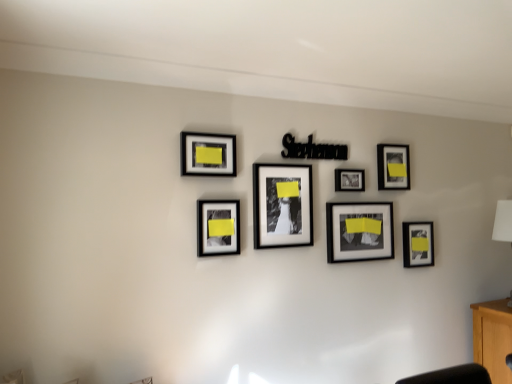
In order to face beech wood cabinet at lower right, should I rotate leftwards or rightwards?

You should look right and rotate roughly 31.203 degrees.

Measure the distance between matte black photo frame at center, the 3th picture frame from the left, and camera.

The distance of matte black photo frame at center, the 3th picture frame from the left, from camera is 6.80 feet.

The width and height of the screenshot is (512, 384). I want to click on black matte picture frame at center, which is the 3th picture frame in right-to-left order, so click(x=359, y=231).

What do you see at coordinates (349, 180) in the screenshot? I see `black matte picture frame at center, the 4th picture frame when ordered from right to left` at bounding box center [349, 180].

This screenshot has width=512, height=384. I want to click on matte black picture frame at center-left, arranged as the 6th picture frame when viewed from the right, so click(218, 227).

What do you see at coordinates (208, 154) in the screenshot? The width and height of the screenshot is (512, 384). I see `matte black frame at upper left, positioned as the seventh picture frame in right-to-left order` at bounding box center [208, 154].

In order to click on matte black frame at lower right, which appears as the seventh picture frame when viewed from the left in this screenshot , I will do `click(418, 244)`.

This screenshot has width=512, height=384. What do you see at coordinates (418, 244) in the screenshot? I see `matte black frame at lower right, which appears as the seventh picture frame when viewed from the left` at bounding box center [418, 244].

Locate an element on the screen. matte black picture frame at upper right, positioned as the sixth picture frame in left-to-right order is located at coordinates (393, 167).

Which point is more forward, (415, 232) or (332, 207)?

Point (332, 207)

Between matte black frame at lower right, which is the 1th picture frame from right to left, and black matte picture frame at center, which is the 3th picture frame in right-to-left order, which one has larger width?

Wider between the two is matte black frame at lower right, which is the 1th picture frame from right to left.

Can black matte picture frame at center, which is the 3th picture frame in right-to-left order, be found inside matte black frame at lower right, which appears as the seventh picture frame when viewed from the left?

No, black matte picture frame at center, which is the 3th picture frame in right-to-left order, is not a part of matte black frame at lower right, which appears as the seventh picture frame when viewed from the left.

From a real-world perspective, who is located higher, matte black frame at lower right, which appears as the seventh picture frame when viewed from the left, or black matte picture frame at center, placed as the fifth picture frame when sorted from left to right?

black matte picture frame at center, placed as the fifth picture frame when sorted from left to right.

Is beech wood cabinet at lower right surrounding white fabric lampshade at right?

Actually, white fabric lampshade at right is outside beech wood cabinet at lower right.

Considering the relative positions of beech wood cabinet at lower right and white fabric lampshade at right in the image provided, is beech wood cabinet at lower right behind white fabric lampshade at right?

No, it is in front of white fabric lampshade at right.

Visually, is beech wood cabinet at lower right positioned to the left or to the right of white fabric lampshade at right?

From the image, it's evident that beech wood cabinet at lower right is to the right of white fabric lampshade at right.

Is there a large distance between beech wood cabinet at lower right and white fabric lampshade at right?

No, beech wood cabinet at lower right is not far away from white fabric lampshade at right.

In the scene shown: Is the depth of matte black picture frame at center-left, arranged as the 6th picture frame when viewed from the right, greater than that of white fabric lampshade at right?

No, matte black picture frame at center-left, arranged as the 6th picture frame when viewed from the right, is closer to the viewer.

From a real-world perspective, between matte black picture frame at center-left, arranged as the 6th picture frame when viewed from the right, and white fabric lampshade at right, who is vertically lower?

white fabric lampshade at right is physically lower.

This screenshot has height=384, width=512. What are the coordinates of `table lamp that is under the matte black picture frame at center-left, arranged as the 6th picture frame when viewed from the right (from a real-world perspective)` in the screenshot? It's located at (503, 221).

Consider the image. Does matte black picture frame at upper right, positioned as the sixth picture frame in left-to-right order, have a greater height compared to matte black photo frame at center, the 3th picture frame from the left?

No.

Are matte black picture frame at upper right, positioned as the sixth picture frame in left-to-right order, and matte black photo frame at center, the fifth picture frame when ordered from right to left, located far from each other?

That's not correct — matte black picture frame at upper right, positioned as the sixth picture frame in left-to-right order, is a little close to matte black photo frame at center, the fifth picture frame when ordered from right to left.

Can you confirm if matte black picture frame at upper right, which is the 2th picture frame in right-to-left order, is positioned to the left of matte black photo frame at center, the 3th picture frame from the left?

No.

From the image's perspective, between matte black picture frame at upper right, which is the 2th picture frame in right-to-left order, and matte black photo frame at center, the fifth picture frame when ordered from right to left, who is located below?

matte black photo frame at center, the fifth picture frame when ordered from right to left, from the image's perspective.

Can we say matte black picture frame at upper right, which is the 2th picture frame in right-to-left order, lies outside matte black picture frame at center-left, the second picture frame positioned from the left?

Yes, matte black picture frame at upper right, which is the 2th picture frame in right-to-left order, is located beyond the bounds of matte black picture frame at center-left, the second picture frame positioned from the left.

Is matte black picture frame at upper right, positioned as the sixth picture frame in left-to-right order, further to the viewer compared to matte black picture frame at center-left, arranged as the 6th picture frame when viewed from the right?

Yes, the depth of matte black picture frame at upper right, positioned as the sixth picture frame in left-to-right order, is greater than that of matte black picture frame at center-left, arranged as the 6th picture frame when viewed from the right.

How many degrees apart are the facing directions of matte black picture frame at upper right, positioned as the sixth picture frame in left-to-right order, and matte black picture frame at center-left, the second picture frame positioned from the left?

The facing directions of matte black picture frame at upper right, positioned as the sixth picture frame in left-to-right order, and matte black picture frame at center-left, the second picture frame positioned from the left, are 0.00107 degrees apart.

Is matte black picture frame at upper right, which is the 2th picture frame in right-to-left order, turned away from matte black picture frame at center-left, arranged as the 6th picture frame when viewed from the right?

No, matte black picture frame at center-left, arranged as the 6th picture frame when viewed from the right, is not at the back of matte black picture frame at upper right, which is the 2th picture frame in right-to-left order.

Does matte black frame at lower right, which appears as the seventh picture frame when viewed from the left, have a greater width compared to matte black picture frame at center-left, arranged as the 6th picture frame when viewed from the right?

Yes, matte black frame at lower right, which appears as the seventh picture frame when viewed from the left, is wider than matte black picture frame at center-left, arranged as the 6th picture frame when viewed from the right.

Is matte black frame at lower right, which appears as the seventh picture frame when viewed from the left, oriented away from matte black picture frame at center-left, the second picture frame positioned from the left?

No, matte black picture frame at center-left, the second picture frame positioned from the left, is not at the back of matte black frame at lower right, which appears as the seventh picture frame when viewed from the left.

Measure the distance between matte black frame at lower right, which is the 1th picture frame from right to left, and matte black picture frame at center-left, the second picture frame positioned from the left.

The distance of matte black frame at lower right, which is the 1th picture frame from right to left, from matte black picture frame at center-left, the second picture frame positioned from the left, is 1.15 meters.

Looking at this image, is matte black frame at lower right, which appears as the seventh picture frame when viewed from the left, further to camera compared to matte black picture frame at center-left, arranged as the 6th picture frame when viewed from the right?

Yes, the depth of matte black frame at lower right, which appears as the seventh picture frame when viewed from the left, is greater than that of matte black picture frame at center-left, arranged as the 6th picture frame when viewed from the right.

Is white fabric lampshade at right turned away from beech wood cabinet at lower right?

white fabric lampshade at right does not have its back to beech wood cabinet at lower right.

Choose the correct answer: Is white fabric lampshade at right inside beech wood cabinet at lower right or outside it?

white fabric lampshade at right is not inside beech wood cabinet at lower right, it's outside.

Does white fabric lampshade at right appear on the right side of beech wood cabinet at lower right?

No, white fabric lampshade at right is not to the right of beech wood cabinet at lower right.

In the scene shown: Can you confirm if white fabric lampshade at right is thinner than beech wood cabinet at lower right?

Correct, the width of white fabric lampshade at right is less than that of beech wood cabinet at lower right.

There is a matte black frame at lower right, which appears as the seventh picture frame when viewed from the left. Where is `the 1st picture frame above it (from a real-world perspective)`? The height and width of the screenshot is (384, 512). the 1st picture frame above it (from a real-world perspective) is located at coordinates (359, 231).

The height and width of the screenshot is (384, 512). What are the coordinates of `computer desk directly beneath the white fabric lampshade at right (from a real-world perspective)` in the screenshot? It's located at tap(493, 338).

Estimate the real-world distances between objects in this image. Which object is closer to matte black frame at lower right, which is the 1th picture frame from right to left, matte black picture frame at upper right, which is the 2th picture frame in right-to-left order, or black matte picture frame at center, placed as the fifth picture frame when sorted from left to right?

The object closer to matte black frame at lower right, which is the 1th picture frame from right to left, is black matte picture frame at center, placed as the fifth picture frame when sorted from left to right.

Looking at the image, which one is located further to matte black picture frame at center-left, arranged as the 6th picture frame when viewed from the right, matte black frame at upper left, positioned as the seventh picture frame in right-to-left order, or matte black photo frame at center, the 3th picture frame from the left?

matte black frame at upper left, positioned as the seventh picture frame in right-to-left order, is further to matte black picture frame at center-left, arranged as the 6th picture frame when viewed from the right.

Considering their positions, is matte black frame at lower right, which appears as the seventh picture frame when viewed from the left, positioned further to matte black frame at upper left, positioned as the seventh picture frame in right-to-left order, than black matte picture frame at center, the 4th picture frame when ordered from right to left?

Among the two, matte black frame at lower right, which appears as the seventh picture frame when viewed from the left, is located further to matte black frame at upper left, positioned as the seventh picture frame in right-to-left order.

When comparing their distances from beech wood cabinet at lower right, does matte black picture frame at center-left, arranged as the 6th picture frame when viewed from the right, or white fabric lampshade at right seem closer?

Among the two, white fabric lampshade at right is located nearer to beech wood cabinet at lower right.

Considering their positions, is black matte picture frame at center, which is the 3th picture frame in right-to-left order, positioned closer to matte black photo frame at center, the 3th picture frame from the left, than matte black picture frame at center-left, the second picture frame positioned from the left?

Based on the image, matte black picture frame at center-left, the second picture frame positioned from the left, appears to be nearer to matte black photo frame at center, the 3th picture frame from the left.

When comparing their distances from beech wood cabinet at lower right, does matte black frame at upper left, positioned as the seventh picture frame in right-to-left order, or black matte picture frame at center, the 4th picture frame when ordered from right to left, seem closer?

Based on the image, black matte picture frame at center, the 4th picture frame when ordered from right to left, appears to be nearer to beech wood cabinet at lower right.

Looking at this image, estimate the real-world distances between objects in this image. Which object is further from beech wood cabinet at lower right, matte black frame at upper left, positioned as the seventh picture frame in right-to-left order, or matte black frame at lower right, which appears as the seventh picture frame when viewed from the left?

The object further to beech wood cabinet at lower right is matte black frame at upper left, positioned as the seventh picture frame in right-to-left order.

Which object lies further to the anchor point black matte picture frame at center, which is the 3th picture frame in right-to-left order, matte black picture frame at center-left, arranged as the 6th picture frame when viewed from the right, or white fabric lampshade at right?

Based on the image, white fabric lampshade at right appears to be further to black matte picture frame at center, which is the 3th picture frame in right-to-left order.

Where is `table lamp between matte black picture frame at upper right, positioned as the sixth picture frame in left-to-right order, and beech wood cabinet at lower right in the up-down direction`? This screenshot has width=512, height=384. table lamp between matte black picture frame at upper right, positioned as the sixth picture frame in left-to-right order, and beech wood cabinet at lower right in the up-down direction is located at coordinates click(x=503, y=221).

The width and height of the screenshot is (512, 384). What are the coordinates of `table lamp situated between black matte picture frame at center, which is the 3th picture frame in right-to-left order, and beech wood cabinet at lower right from left to right` in the screenshot? It's located at (503, 221).

The width and height of the screenshot is (512, 384). Find the location of `table lamp between black matte picture frame at center, the 4th picture frame when ordered from right to left, and beech wood cabinet at lower right`. table lamp between black matte picture frame at center, the 4th picture frame when ordered from right to left, and beech wood cabinet at lower right is located at coordinates (503, 221).

This screenshot has width=512, height=384. What are the coordinates of `picture frame situated between matte black picture frame at upper right, positioned as the sixth picture frame in left-to-right order, and white fabric lampshade at right from left to right` in the screenshot? It's located at (418, 244).